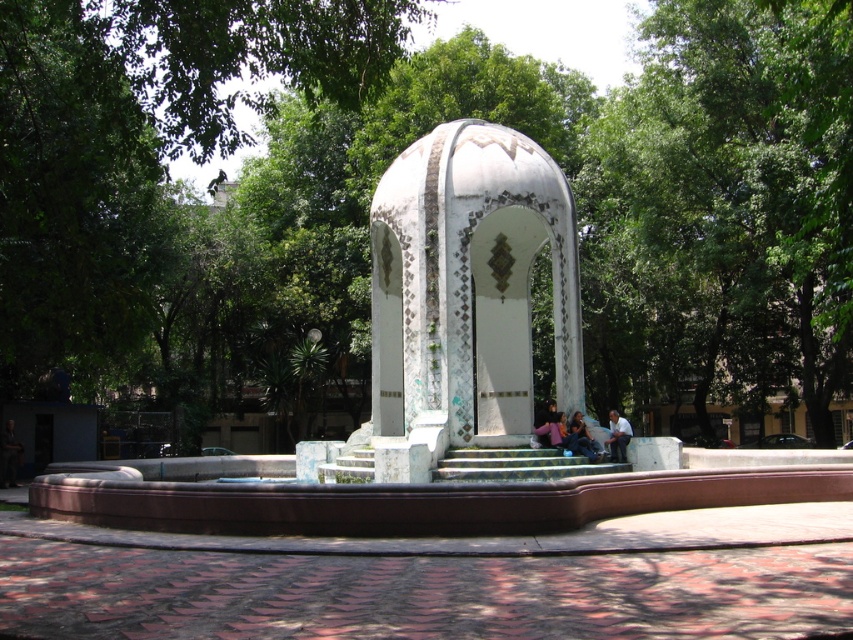
Question: Estimate the real-world distances between objects in this image. Which object is closer to the light blue stone bench at center?

Choices:
 (A) green leafy tree at upper center
 (B) blue denim jeans at center
 (C) white mosaic gazebo at center

Answer: (B)

Question: Does white mosaic gazebo at center lie behind light blue stone bench at center?

Choices:
 (A) yes
 (B) no

Answer: (B)

Question: Among these objects, which one is farthest from the camera?

Choices:
 (A) white mosaic gazebo at center
 (B) green leafy tree at upper center
 (C) blue denim jeans at center

Answer: (C)

Question: Based on their relative distances, which object is farther from the light blue stone bench at center?

Choices:
 (A) white mosaic gazebo at center
 (B) blue denim jeans at lower center
 (C) blue denim jeans at center
 (D) green leafy tree at upper center

Answer: (D)

Question: Can you confirm if green leafy tree at upper center is smaller than white mosaic gazebo at center?

Choices:
 (A) no
 (B) yes

Answer: (A)

Question: From the image, what is the correct spatial relationship of green leafy tree at center in relation to white mosaic gazebo at center?

Choices:
 (A) left
 (B) right

Answer: (A)